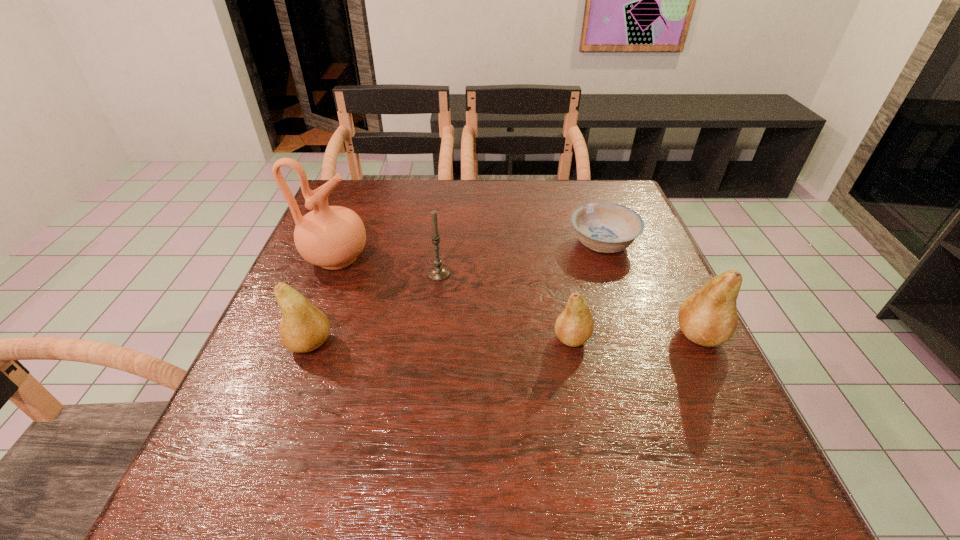
Where is `free space located on the left of the candle`? This screenshot has height=540, width=960. free space located on the left of the candle is located at coordinates (402, 274).

In order to click on blank space located on the front of the bowl in this screenshot , I will do `click(615, 281)`.

Locate an element on the screen. This screenshot has height=540, width=960. free space located 0.170m on the spout of the tallest object is located at coordinates (438, 259).

The image size is (960, 540). What are the coordinates of `pear that is positioned at the left edge` in the screenshot? It's located at pyautogui.click(x=303, y=328).

Locate an element on the screen. The width and height of the screenshot is (960, 540). pottery located in the left edge section of the desktop is located at coordinates (332, 237).

Locate an element on the screen. The height and width of the screenshot is (540, 960). pear present at the right edge is located at coordinates (708, 317).

This screenshot has width=960, height=540. In order to click on bowl present at the right edge in this screenshot , I will do `click(604, 227)`.

Image resolution: width=960 pixels, height=540 pixels. Identify the location of vacant position at the far edge of the desktop. (498, 204).

The width and height of the screenshot is (960, 540). Identify the location of blank area at the near edge. (612, 426).

Find the location of a particular element. The image size is (960, 540). vacant space at the left edge is located at coordinates (276, 326).